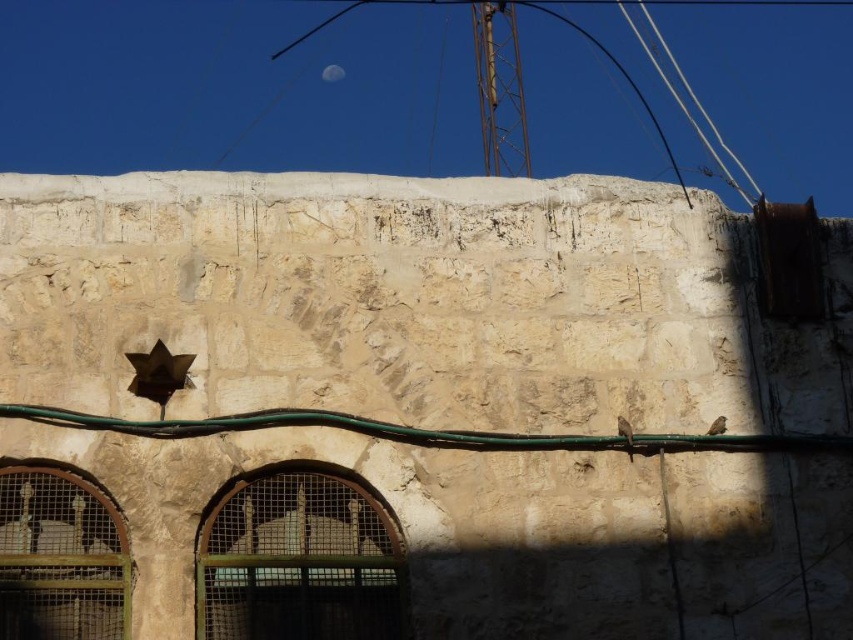
You are an ornithologist observing the stone wall. You notice the green rubber wire at center and the silvery reflective moon at upper center. Which object has a greater width?

The green rubber wire at center has a greater width than the silvery reflective moon at upper center.

You are a bird perched on the green rubber wire at center and want to fly to the silvery reflective moon at upper center. Which direction should you fly to reach it?

The green rubber wire at center is below the silvery reflective moon at upper center, so you should fly upward to reach it.

You are standing in front of the stone wall and want to place a small bird feeder between the green rubber wire at center and the silvery reflective moon at upper center. Can you determine which object you should place it closer to in order to ensure it is visible from your current position?

The green rubber wire at center is closer to the viewer than the silvery reflective moon at upper center, so placing the bird feeder closer to the green rubber wire at center would make it more visible from your current position.